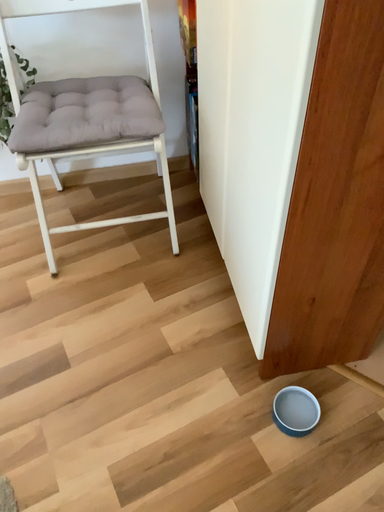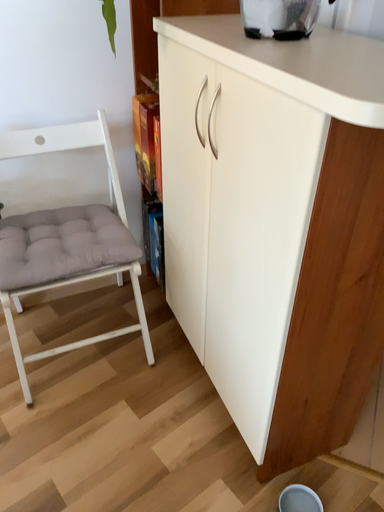
Question: How did the camera likely rotate when shooting the video?

Choices:
 (A) rotated right
 (B) rotated left

Answer: (A)